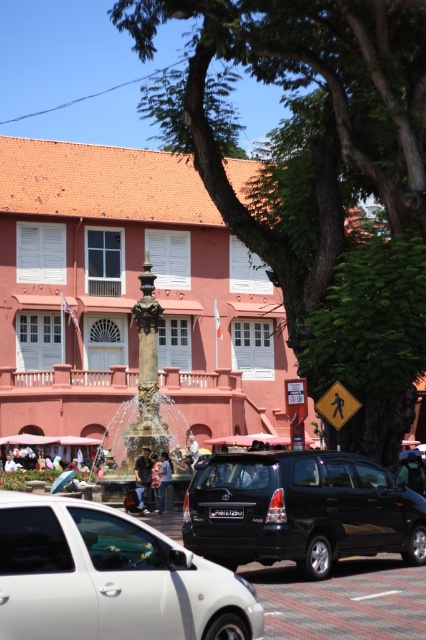
Question: Is black matte suv at center in front of bronze ornate fountain at center?

Choices:
 (A) yes
 (B) no

Answer: (A)

Question: Which point appears farthest from the camera in this image?

Choices:
 (A) (158, 320)
 (B) (207, 570)
 (C) (230, 480)

Answer: (A)

Question: Which point is farther to the camera?

Choices:
 (A) bronze ornate fountain at center
 (B) white matte car at center
 (C) black matte suv at center

Answer: (A)

Question: Which of these objects is positioned farthest from the black matte suv at center?

Choices:
 (A) white matte car at center
 (B) bronze ornate fountain at center

Answer: (B)

Question: Does black matte suv at center appear on the left side of bronze ornate fountain at center?

Choices:
 (A) no
 (B) yes

Answer: (A)

Question: Can you confirm if white matte car at center is bigger than black matte suv at center?

Choices:
 (A) yes
 (B) no

Answer: (B)